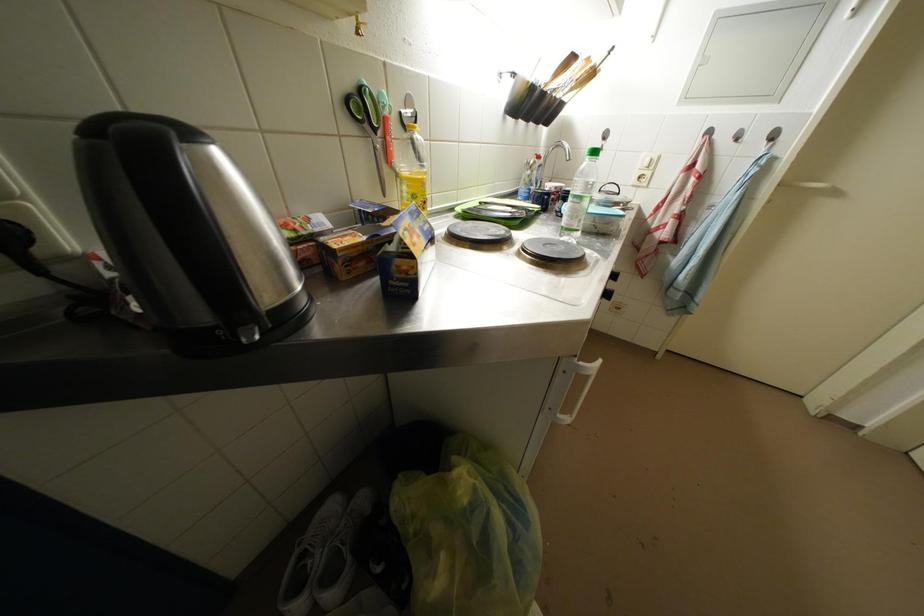
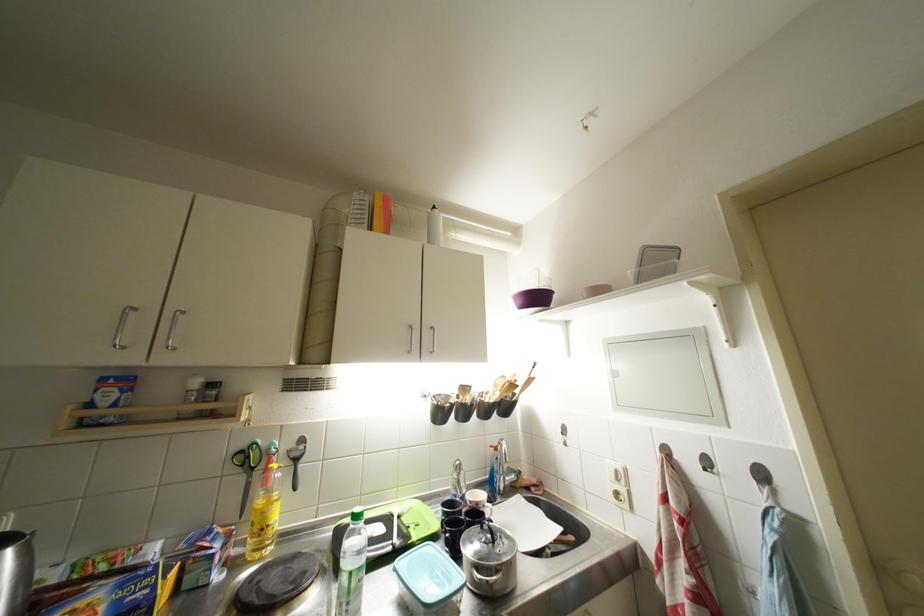
Locate, in the second image, the point that corresponds to [781,140] in the first image.

(769, 479)